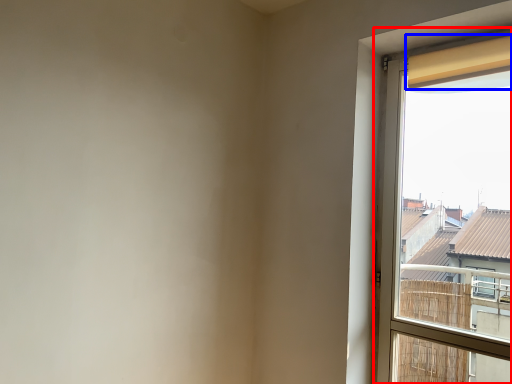
Question: Which point is further to the camera, window (highlighted by a red box) or curtain (highlighted by a blue box)?

Choices:
 (A) window
 (B) curtain

Answer: (B)